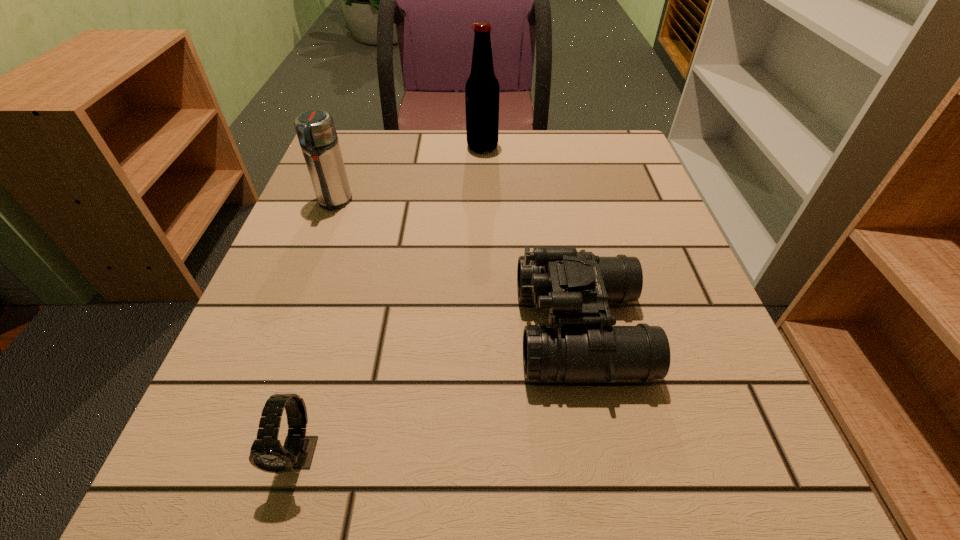
In the image, there is a desktop. Identify the location of vacant space at the near edge. The height and width of the screenshot is (540, 960). (357, 517).

Locate an element on the screen. The width and height of the screenshot is (960, 540). free point at the left edge is located at coordinates (234, 370).

Identify the location of free region at the far left corner. The height and width of the screenshot is (540, 960). (351, 145).

In the image, there is a desktop. What are the coordinates of `vacant space at the far right corner` in the screenshot? It's located at (580, 148).

Image resolution: width=960 pixels, height=540 pixels. I want to click on blank space at the near right corner, so click(680, 449).

You are a GUI agent. You are given a task and a screenshot of the screen. Output one action in this format:
    pyautogui.click(x=<x>, y=<y>)
    Task: Click on the free area in between the third object from right to left and the thermos bottle
    The height and width of the screenshot is (540, 960).
    Given the screenshot: What is the action you would take?
    pyautogui.click(x=317, y=328)

Find the location of `vacant space in between the binoculars and the second object from right to left`. vacant space in between the binoculars and the second object from right to left is located at coordinates (531, 238).

Where is `vacant area between the nearest object and the third object from left to right`? This screenshot has height=540, width=960. vacant area between the nearest object and the third object from left to right is located at coordinates (391, 300).

Where is `free space between the leftmost object and the farthest object`? free space between the leftmost object and the farthest object is located at coordinates (408, 174).

The width and height of the screenshot is (960, 540). Identify the location of vacant space that's between the second farthest object and the rightmost object. (457, 266).